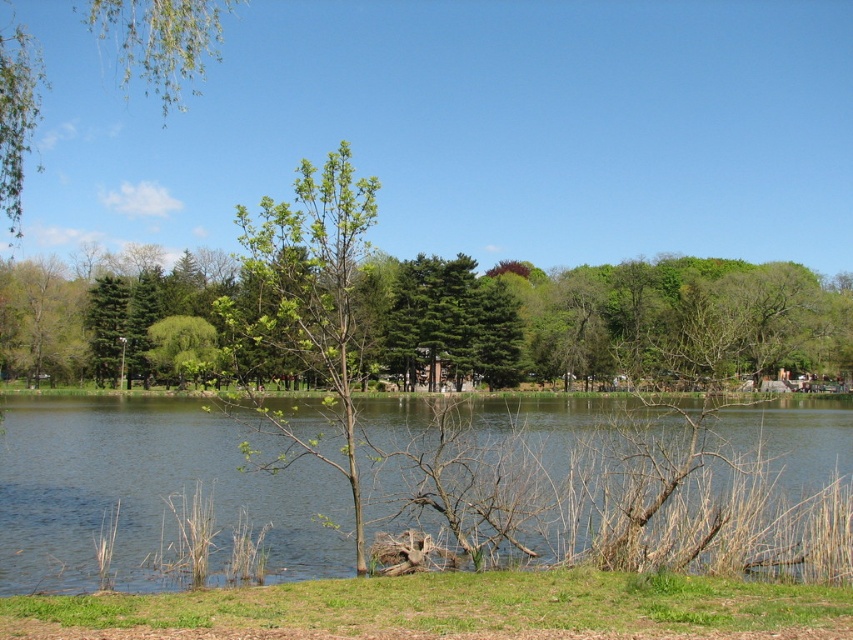
You are standing on the green grass at lower center and want to walk towards the green leafy tree at center. Which direction should you move to get closer to the tree?

Since the green leafy tree at center is further to the viewer than the green grass at lower center, you should move backward to get closer to the tree.

You are standing at the edge of the lake and want to walk towards the green leafy tree at center. However, there is a green leafy tree at upper left in your way. Which tree should you avoid to reach your destination?

You should avoid the green leafy tree at upper left because the green leafy tree at center is closer to the viewer, meaning the tree at upper left is further away and not blocking your path directly. However, since the question mentions the upper left tree is in your way, there might be a spatial misunderstanding. Based on the description, the center tree is closer, so the upper left tree is behind it and not obstructing the path. Therefore, you don need to avoid it. Wait, this is confusing. Let me recheck.

You are standing on the green grass at lower center and want to walk to the green leafy tree at center. Which direction should you head towards?

You should head to the right because the green leafy tree at center is positioned on the left side of green grass at lower center.